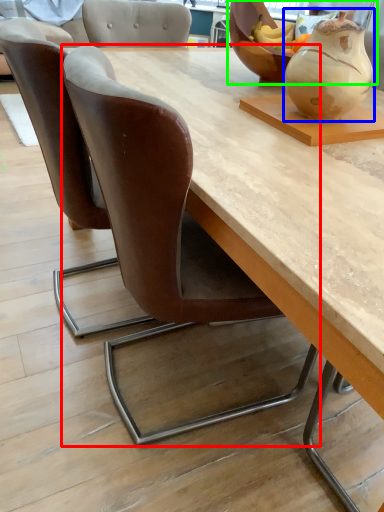
Question: Estimate the real-world distances between objects in this image. Which object is closer to chair (highlighted by a red box), vase (highlighted by a blue box) or bowl (highlighted by a green box)?

Choices:
 (A) vase
 (B) bowl

Answer: (A)